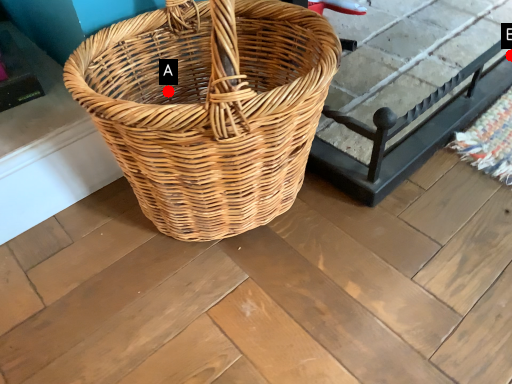
Question: Two points are circled on the image, labeled by A and B beside each circle. Which of the following is the farthest from the observer?

Choices:
 (A) A is further
 (B) B is further

Answer: (B)